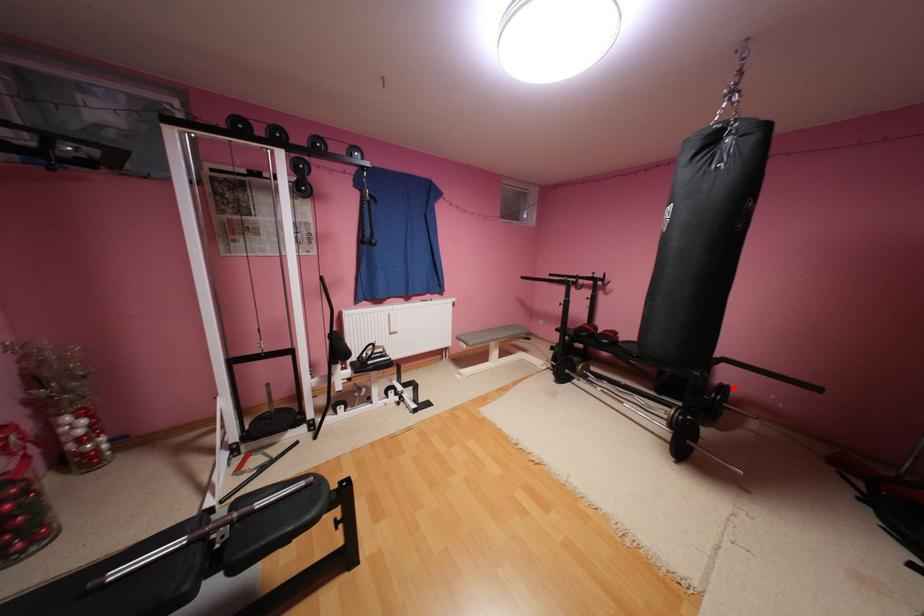
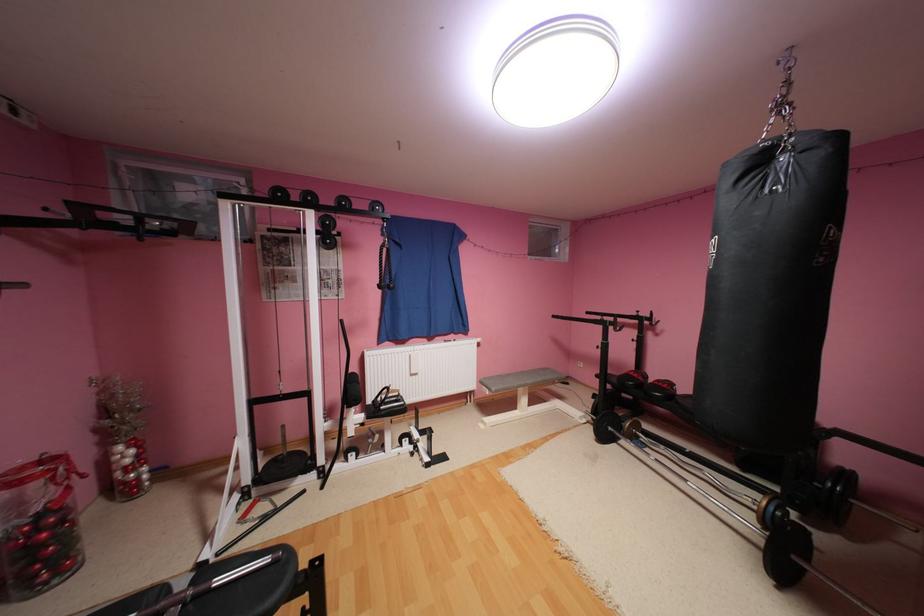
Where in the second image is the point corresponding to the highlighted location from the first image?

(857, 475)